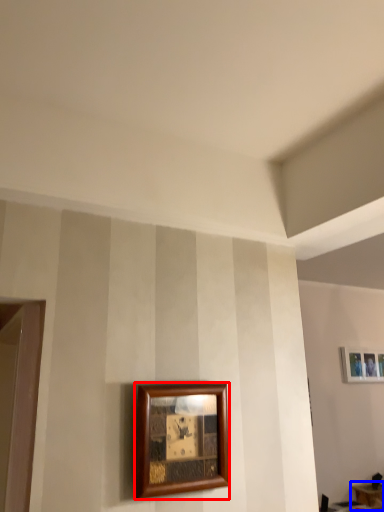
Question: Which object appears farthest to the camera in this image, picture frame (highlighted by a red box) or table (highlighted by a blue box)?

Choices:
 (A) picture frame
 (B) table

Answer: (B)